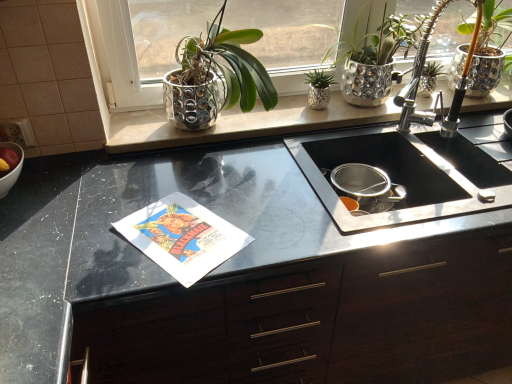
Where is `vacant area that lies between satin nickel faucet at upper right and white glossy bowl at left`? This screenshot has width=512, height=384. vacant area that lies between satin nickel faucet at upper right and white glossy bowl at left is located at coordinates (183, 175).